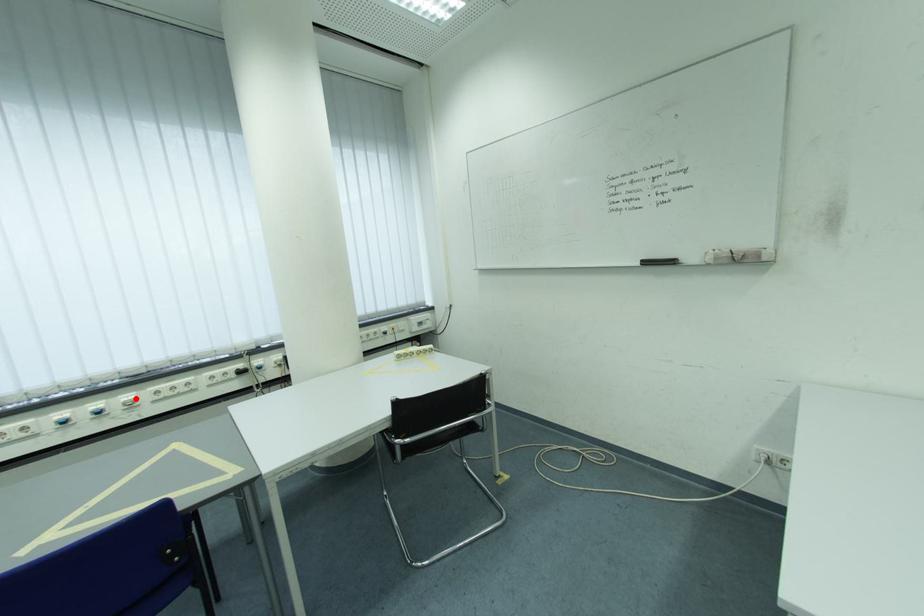
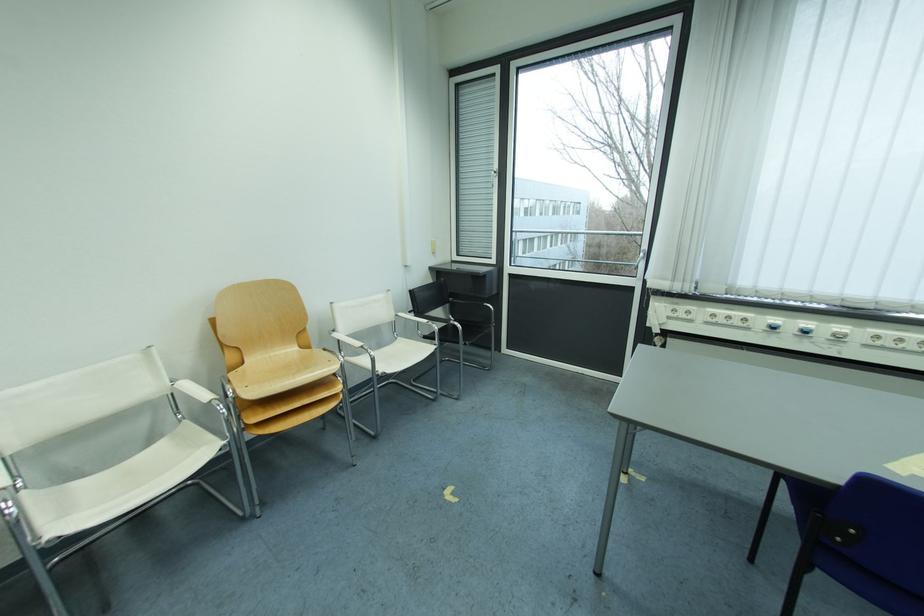
Find the pixel in the second image that matches the highlighted location in the first image.

(849, 330)